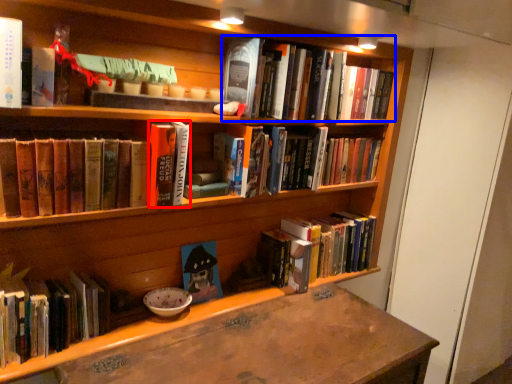
Question: Which point is closer to the camera, book (highlighted by a red box) or book (highlighted by a blue box)?

Choices:
 (A) book
 (B) book

Answer: (A)